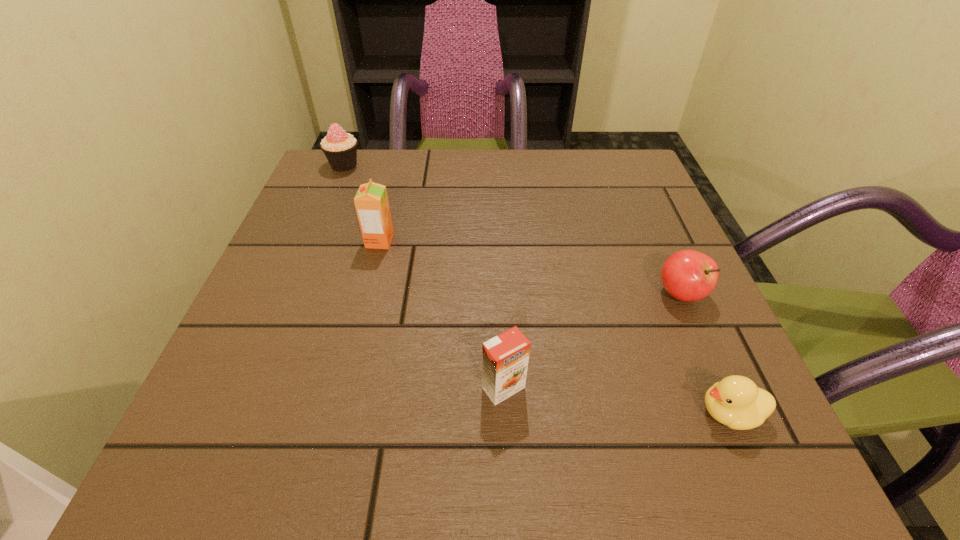
Locate an element on the screen. This screenshot has height=540, width=960. the fourth nearest object is located at coordinates (371, 201).

Identify the location of the taller orange juice. (371, 201).

Find the location of a particular element. cupcake is located at coordinates (340, 148).

At what (x,y) coordinates should I click in order to perform the action: click on the farthest object. Please return your answer as a coordinate pair (x, y). Image resolution: width=960 pixels, height=540 pixels. Looking at the image, I should click on (340, 148).

You are a GUI agent. You are given a task and a screenshot of the screen. Output one action in this format:
    pyautogui.click(x=<x>, y=<y>)
    Task: Click on the nearer orange juice
    This screenshot has height=540, width=960.
    Given the screenshot: What is the action you would take?
    pyautogui.click(x=505, y=357)

In order to click on the shorter orange juice in this screenshot , I will do `click(505, 357)`.

Image resolution: width=960 pixels, height=540 pixels. I want to click on apple, so click(x=688, y=275).

Image resolution: width=960 pixels, height=540 pixels. I want to click on duckling, so click(x=735, y=401).

Where is `vacant region located on the front of the farther orange juice`? vacant region located on the front of the farther orange juice is located at coordinates pos(330,440).

What are the coordinates of `free space located on the front of the farthest object` in the screenshot? It's located at (302, 266).